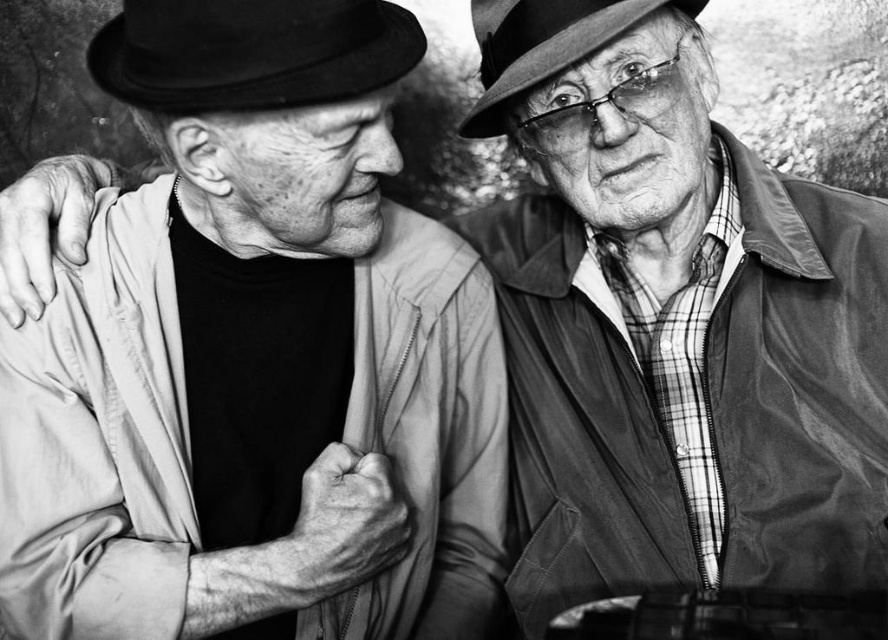
Question: Which object appears closest to the camera in this image?

Choices:
 (A) matte black hat at upper right
 (B) black felt fedora at upper left

Answer: (B)

Question: Is black felt fedora at upper left smaller than matte black hat at upper right?

Choices:
 (A) no
 (B) yes

Answer: (B)

Question: Which point is farther to the camera?

Choices:
 (A) (494, 97)
 (B) (342, 83)

Answer: (A)

Question: Can you confirm if black felt fedora at upper left is positioned to the right of matte black hat at upper right?

Choices:
 (A) yes
 (B) no

Answer: (B)

Question: Does black felt fedora at upper left have a greater width compared to matte black hat at upper right?

Choices:
 (A) yes
 (B) no

Answer: (A)